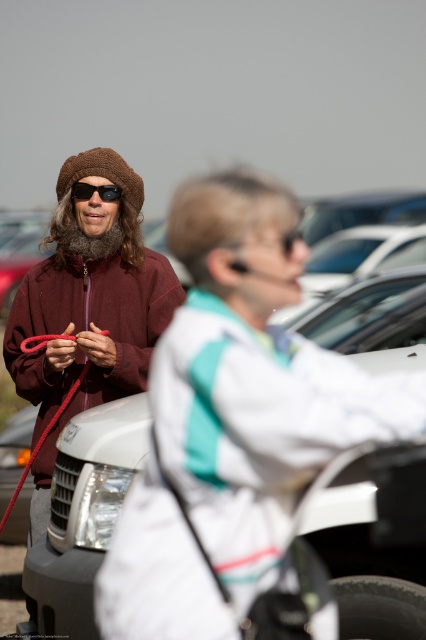
From the picture: You are a delivery person trying to secure a package to your vehicle. You see the white glossy car at left and the red leather leash at left. Which object is positioned higher up in the image?

The white glossy car at left is positioned higher up in the image than the red leather leash at left.